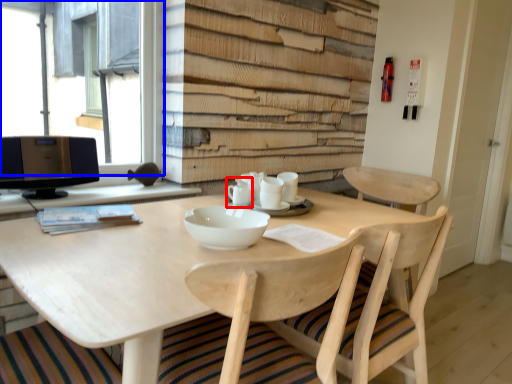
Question: Which of the following is the farthest to the observer, tableware (highlighted by a red box) or window (highlighted by a blue box)?

Choices:
 (A) tableware
 (B) window

Answer: (A)